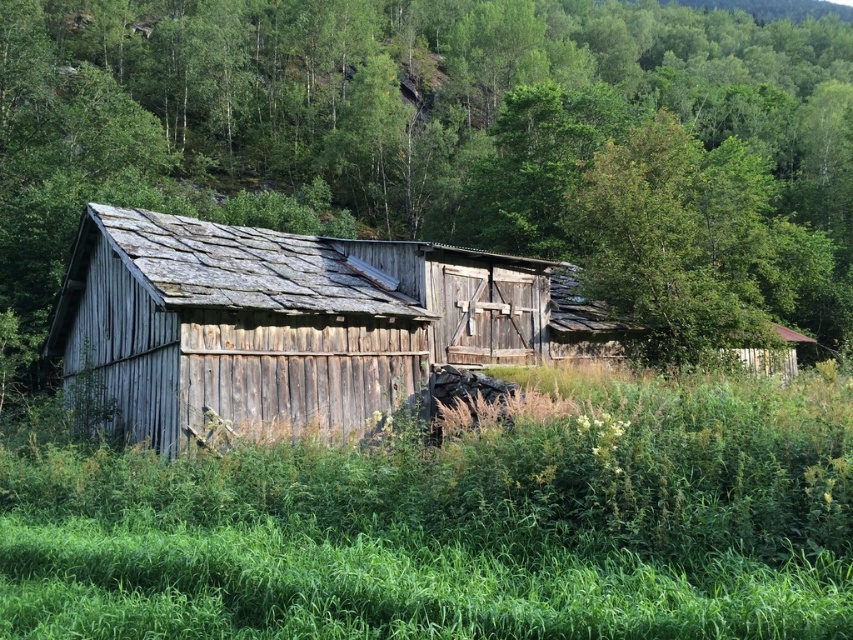
You are standing at the entrance of the rustic wooden structure and looking towards the point indicated by the coordinates. What do you see at the location marked by point (457,525)?

At the coordinates point (457,525), you see green grass at lower center.

You are a hiker who wants to take a photo of the weathered wood barn at center from the green wood tree at center. Can you stand at the tree and take a clear photo of the barn without any obstructions?

The green wood tree at center is 129.36 feet away from the weathered wood barn at center. Since the distance is quite far, the vegetation around the barn might not block the view. Therefore, you can likely take a clear photo of the weathered wood barn at center from the green wood tree at center.

You are standing in front of the rustic wooden barn and want to step onto the area where the green grass at lower center is located. Based on the coordinates provided, can you determine if the grass is directly in front of the barn or to the side?

The green grass at lower center is located at point coordinates, so it is directly in front of the barn.